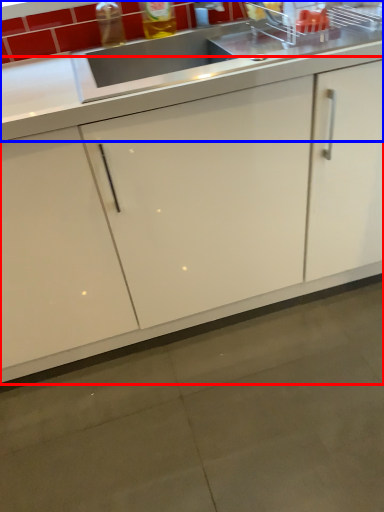
Question: Which object appears closest to the camera in this image, cabinetry (highlighted by a red box) or countertop (highlighted by a blue box)?

Choices:
 (A) cabinetry
 (B) countertop

Answer: (A)